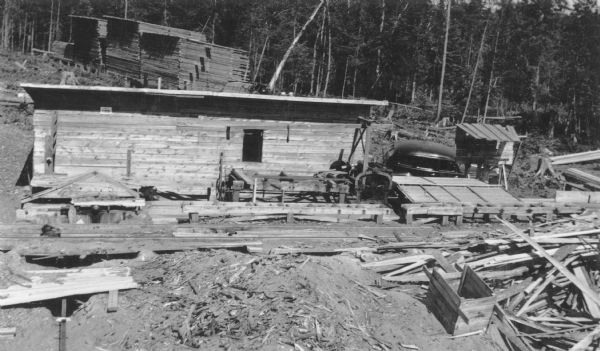
I want to click on back window, so click(389, 156).